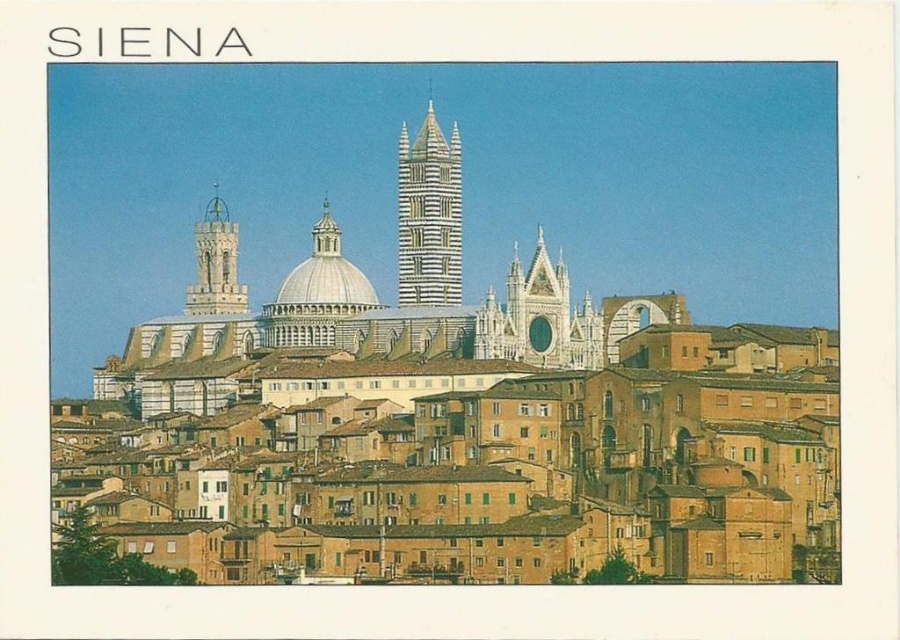
Question: Is white marble dome at center to the left of matte white tower at upper left from the viewer's perspective?

Choices:
 (A) no
 (B) yes

Answer: (A)

Question: Which point is farther to the camera?

Choices:
 (A) white striped tower at center
 (B) matte white tower at upper left

Answer: (B)

Question: Is white striped tower at center above white marble dome at center?

Choices:
 (A) no
 (B) yes

Answer: (B)

Question: Which of the following is the closest to the observer?

Choices:
 (A) pos(435,179)
 (B) pos(208,280)
 (C) pos(324,257)

Answer: (C)

Question: Which point is closer to the camera taking this photo?

Choices:
 (A) tap(360, 276)
 (B) tap(444, 262)
 (C) tap(200, 289)

Answer: (A)

Question: Does white striped tower at center appear under matte white tower at upper left?

Choices:
 (A) yes
 (B) no

Answer: (B)